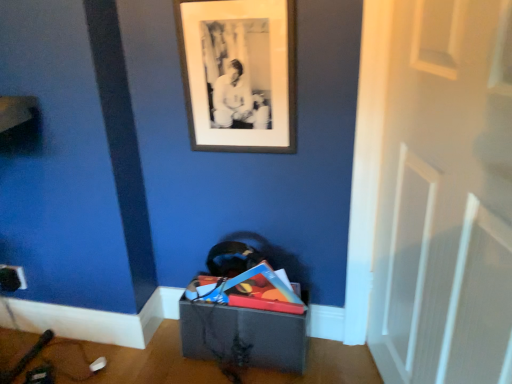
Question: Is white matte door at center inside black matte picture frame at upper center?

Choices:
 (A) no
 (B) yes

Answer: (A)

Question: Is black matte picture frame at upper center far from white matte door at center?

Choices:
 (A) yes
 (B) no

Answer: (B)

Question: Does black matte picture frame at upper center appear on the left side of white matte door at center?

Choices:
 (A) yes
 (B) no

Answer: (A)

Question: From the image's perspective, is black matte picture frame at upper center located above white matte door at center?

Choices:
 (A) yes
 (B) no

Answer: (A)

Question: From a real-world perspective, does black matte picture frame at upper center stand above white matte door at center?

Choices:
 (A) yes
 (B) no

Answer: (A)

Question: Does black matte picture frame at upper center have a greater width compared to white matte door at center?

Choices:
 (A) no
 (B) yes

Answer: (A)

Question: Considering the relative sizes of matte gray storage box at lower center and white matte door at center in the image provided, is matte gray storage box at lower center bigger than white matte door at center?

Choices:
 (A) yes
 (B) no

Answer: (B)

Question: Is white matte door at center a part of matte gray storage box at lower center?

Choices:
 (A) yes
 (B) no

Answer: (B)

Question: From the image's perspective, is matte gray storage box at lower center located above white matte door at center?

Choices:
 (A) no
 (B) yes

Answer: (A)

Question: From the image's perspective, would you say matte gray storage box at lower center is shown under white matte door at center?

Choices:
 (A) no
 (B) yes

Answer: (B)

Question: Can you confirm if matte gray storage box at lower center is positioned to the right of white matte door at center?

Choices:
 (A) yes
 (B) no

Answer: (B)

Question: Is matte gray storage box at lower center with white matte door at center?

Choices:
 (A) yes
 (B) no

Answer: (B)

Question: Can we say white matte door at center lies outside matte gray storage box at lower center?

Choices:
 (A) no
 (B) yes

Answer: (B)